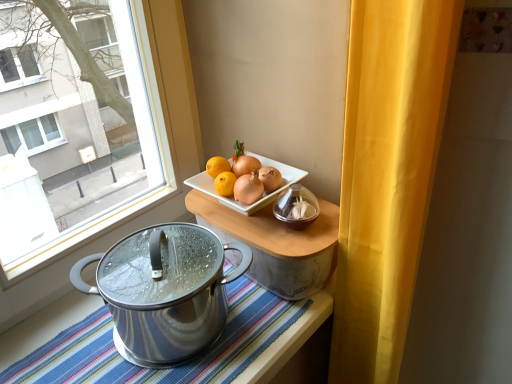
At what (x,y) coordinates should I click in order to perform the action: click on vacant space situated above wooden tray at center (from a real-world perspective). Please return your answer as a coordinate pair (x, y). The width and height of the screenshot is (512, 384). Looking at the image, I should click on (252, 215).